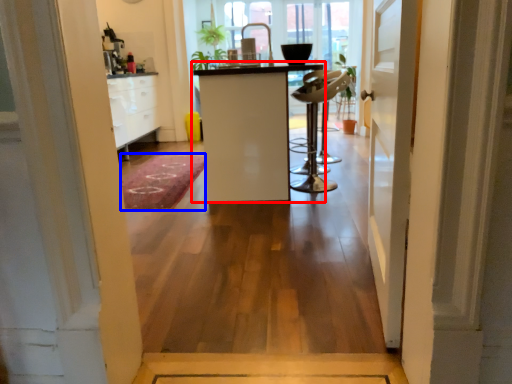
Question: Which object is closer to the camera taking this photo, furniture (highlighted by a red box) or doormat (highlighted by a blue box)?

Choices:
 (A) furniture
 (B) doormat

Answer: (A)